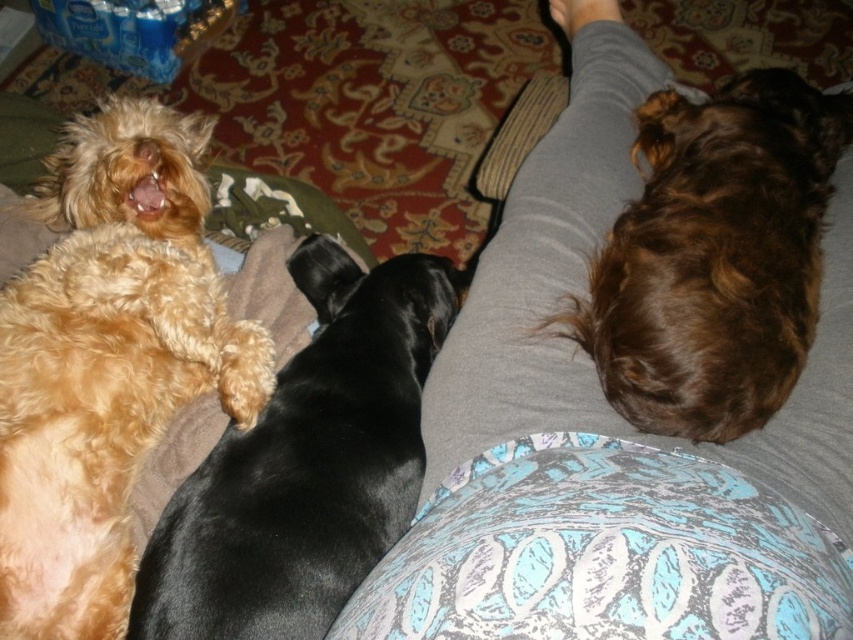
Question: Which of these objects is positioned farthest from the black shiny dog at center?

Choices:
 (A) gray fabric at upper center
 (B) golden fur dog at upper left

Answer: (A)

Question: Does gray fabric at upper center appear under black shiny dog at center?

Choices:
 (A) no
 (B) yes

Answer: (A)

Question: Observing the image, what is the correct spatial positioning of gray fabric at upper center in reference to golden fur dog at upper left?

Choices:
 (A) right
 (B) left

Answer: (A)

Question: Among these points, which one is farthest from the camera?

Choices:
 (A) (772, 588)
 (B) (155, 397)
 (C) (223, 451)

Answer: (B)

Question: Which object is positioned closest to the gray fabric at upper center?

Choices:
 (A) golden fur dog at upper left
 (B) black shiny dog at center

Answer: (B)

Question: Does golden fur dog at upper left have a smaller size compared to black shiny dog at center?

Choices:
 (A) yes
 (B) no

Answer: (B)